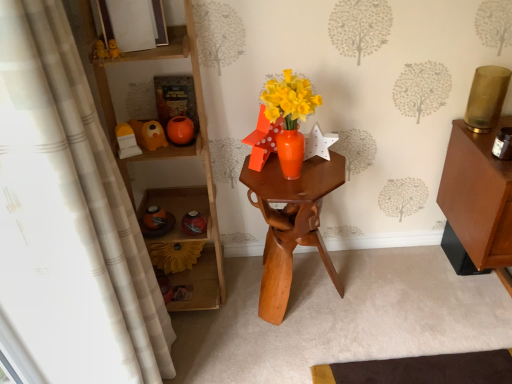
Find the location of a particular element. The image size is (512, 384). empty space that is to the right of white textured curtain at left is located at coordinates (234, 351).